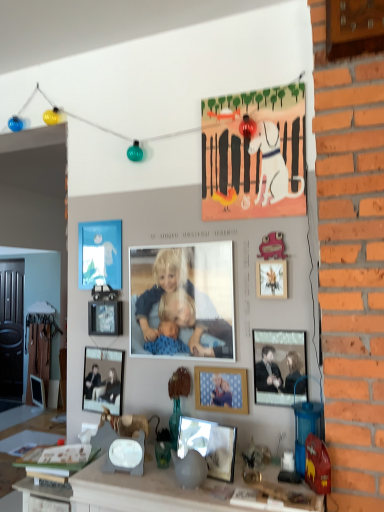
Question: Considering the relative sizes of pink matte picture frame at upper right, acting as the 2th picture frame starting from the right, and metallic reflective frame at center, acting as the second picture frame starting from the bottom, in the image provided, is pink matte picture frame at upper right, acting as the 2th picture frame starting from the right, shorter than metallic reflective frame at center, acting as the second picture frame starting from the bottom,?

Choices:
 (A) no
 (B) yes

Answer: (A)

Question: From a real-world perspective, is pink matte picture frame at upper right, marked as the second picture frame in a top-to-bottom arrangement, beneath metallic reflective frame at center, positioned as the eighth picture frame in back-to-front order?

Choices:
 (A) yes
 (B) no

Answer: (B)

Question: Is pink matte picture frame at upper right, which appears as the 3th picture frame when viewed from the front, smaller than metallic reflective frame at center, placed as the first picture frame when sorted from front to back?

Choices:
 (A) yes
 (B) no

Answer: (A)

Question: From the image's perspective, does pink matte picture frame at upper right, positioned as the seventh picture frame in bottom-to-top order, appear higher than metallic reflective frame at center, placed as the 7th picture frame when sorted from top to bottom?

Choices:
 (A) no
 (B) yes

Answer: (B)

Question: Is pink matte picture frame at upper right, acting as the 2th picture frame starting from the right, at the right side of metallic reflective frame at center, placed as the 7th picture frame when sorted from top to bottom?

Choices:
 (A) yes
 (B) no

Answer: (A)

Question: Is the position of pink matte picture frame at upper right, marked as the second picture frame in a top-to-bottom arrangement, more distant than that of metallic reflective frame at center, the fourth picture frame from the right?

Choices:
 (A) no
 (B) yes

Answer: (B)

Question: Is metallic reflective frame at center, which is counted as the fifth picture frame, starting from the left, outside of metallic silver picture frame at center-left, the fourth picture frame positioned from the back?

Choices:
 (A) no
 (B) yes

Answer: (B)

Question: Does metallic reflective frame at center, which is counted as the fifth picture frame, starting from the left, appear on the left side of metallic silver picture frame at center-left, marked as the sixth picture frame in a bottom-to-top arrangement?

Choices:
 (A) no
 (B) yes

Answer: (A)

Question: Are metallic reflective frame at center, positioned as the eighth picture frame in back-to-front order, and metallic silver picture frame at center-left, marked as the 4th picture frame in a left-to-right arrangement, located far from each other?

Choices:
 (A) no
 (B) yes

Answer: (A)

Question: Is metallic reflective frame at center, which is counted as the fifth picture frame, starting from the left, further to the viewer compared to metallic silver picture frame at center-left, marked as the sixth picture frame in a bottom-to-top arrangement?

Choices:
 (A) yes
 (B) no

Answer: (B)

Question: Considering the relative sizes of metallic reflective frame at center, placed as the 7th picture frame when sorted from top to bottom, and metallic silver picture frame at center-left, which is the 3th picture frame from top to bottom, in the image provided, is metallic reflective frame at center, placed as the 7th picture frame when sorted from top to bottom, shorter than metallic silver picture frame at center-left, which is the 3th picture frame from top to bottom,?

Choices:
 (A) no
 (B) yes

Answer: (B)

Question: Is the position of metallic reflective frame at center, positioned as the eighth picture frame in back-to-front order, less distant than that of metallic silver picture frame at center-left, which is the 3th picture frame from top to bottom?

Choices:
 (A) yes
 (B) no

Answer: (A)

Question: Does pink matte picture frame at upper right, marked as the second picture frame in a top-to-bottom arrangement, appear on the right side of metallic silver picture frame at center-left, marked as the sixth picture frame in a bottom-to-top arrangement?

Choices:
 (A) yes
 (B) no

Answer: (A)